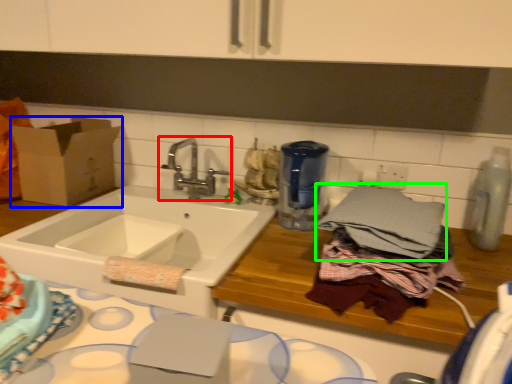
Question: Estimate the real-world distances between objects in this image. Which object is closer to tap (highlighted by a red box), cardboard box (highlighted by a blue box) or bath towel (highlighted by a green box)?

Choices:
 (A) cardboard box
 (B) bath towel

Answer: (A)